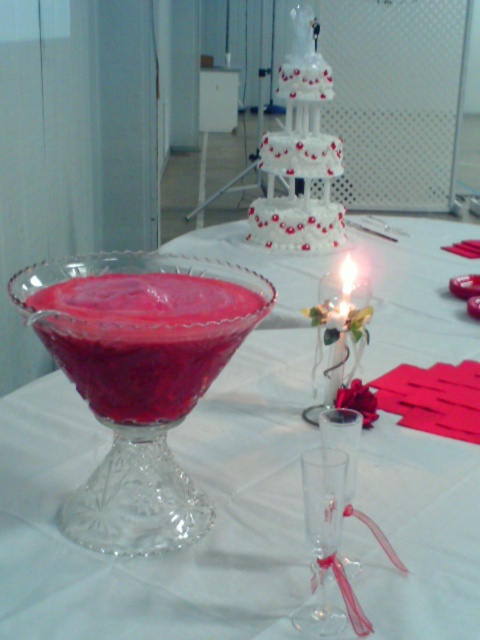
Looking at this image, you are a bartender at the wedding and need to pour drinks for guests. You have a punch bowl with red liquid and two glasses on the table. Which glass, the transparent crystal martini glass at center or the clear glass wine glass at center, can hold more liquid?

The transparent crystal martini glass at center can hold more liquid because it is bigger than the clear glass wine glass at center.

You are a guest at a wedding reception and see the matte glass bowl at center and the transparent glass at center on the table. Which one has a greater height?

The transparent glass at center is taller than the matte glass bowl at center, so the transparent glass at center has a greater height.

You are a guest at the wedding and want to take a photo of the matte glass bowl at center. If your camera can focus on objects up to 40 centimeters away, will you need to move closer or farther away?

The matte glass bowl at center is 37.35 centimeters away from the viewer. Since the camera can focus up to 40 centimeters, you do not need to move closer or farther away. The current distance is within the camera focus range.